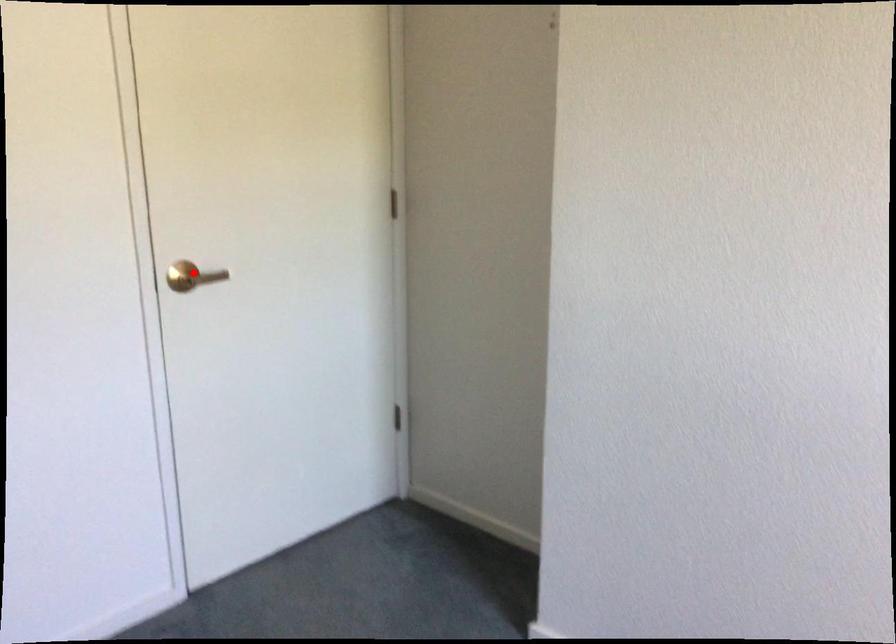
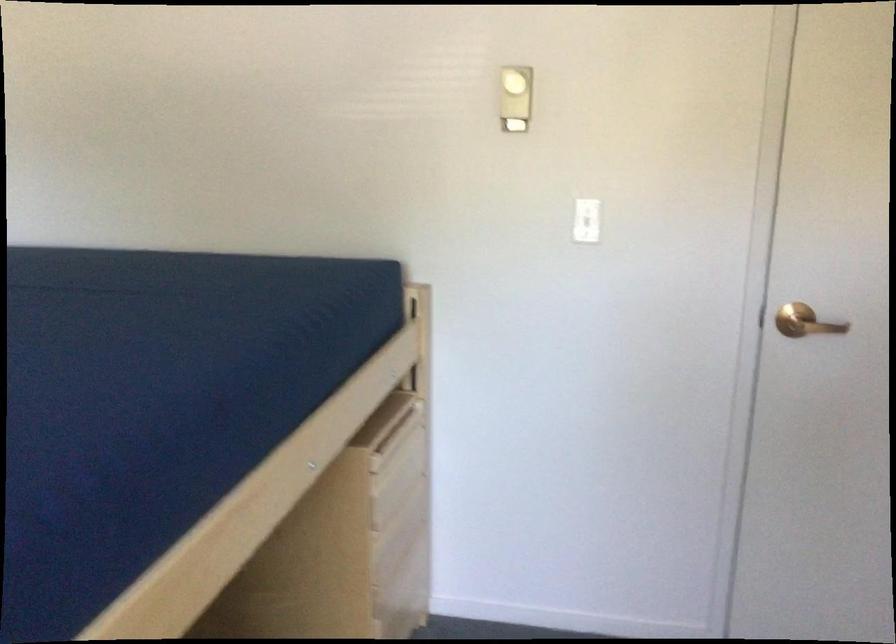
Find the pixel in the second image that matches the highlighted location in the first image.

(805, 322)